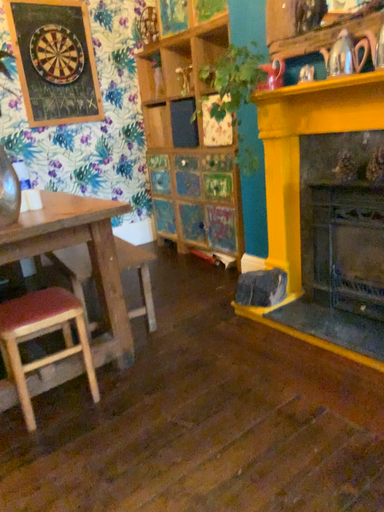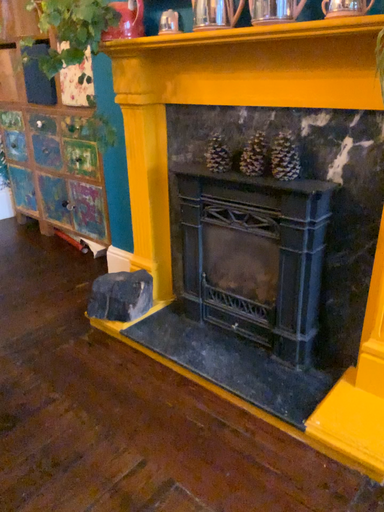
Question: Which way did the camera rotate in the video?

Choices:
 (A) rotated left
 (B) rotated right

Answer: (B)